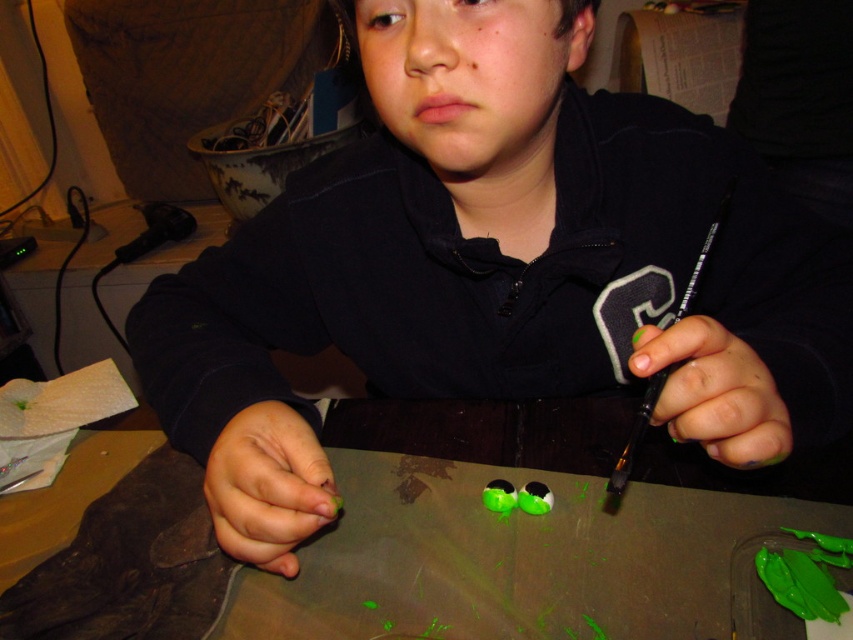
You are organizing a craft fair and need to place a decorative item on the green matte table at center and the green matte nail polish at right. According to the image, which object should be placed to the left of the other to match the original arrangement?

The green matte table at center should be placed to the left of the green matte nail polish at right to match the original arrangement.

You are a delivery robot that needs to place a package on the table in the image. The package is 24 inches wide. Can you fit the package between the point at coordinates [454,410] and the edge of the table without overlapping anything?

The distance between the point at coordinates [454,410] and the camera is 25.84 inches. Since the package is 24 inches wide, it can fit within that space as long as there are no obstructions. However, the description does not mention other objects in that area, so assuming no overlaps, the package should fit.

You are a painter who needs to place a sticker on the exact location of the green matte fingernail at lower center. According to the coordinates provided, where should you place the sticker on the table?

The sticker should be placed at the coordinates point (268, 486) where the green matte fingernail at lower center is located.